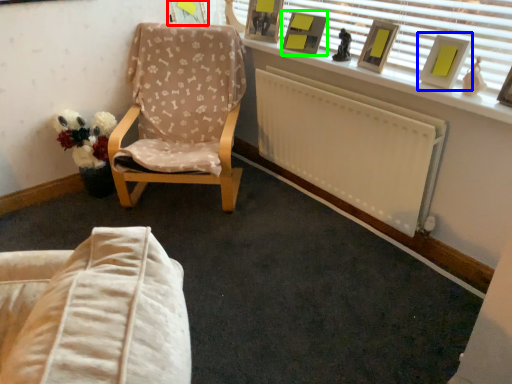
Question: Based on their relative distances, which object is nearer to picture frame (highlighted by a red box)? Choose from picture frame (highlighted by a blue box) and picture frame (highlighted by a green box).

Choices:
 (A) picture frame
 (B) picture frame

Answer: (B)